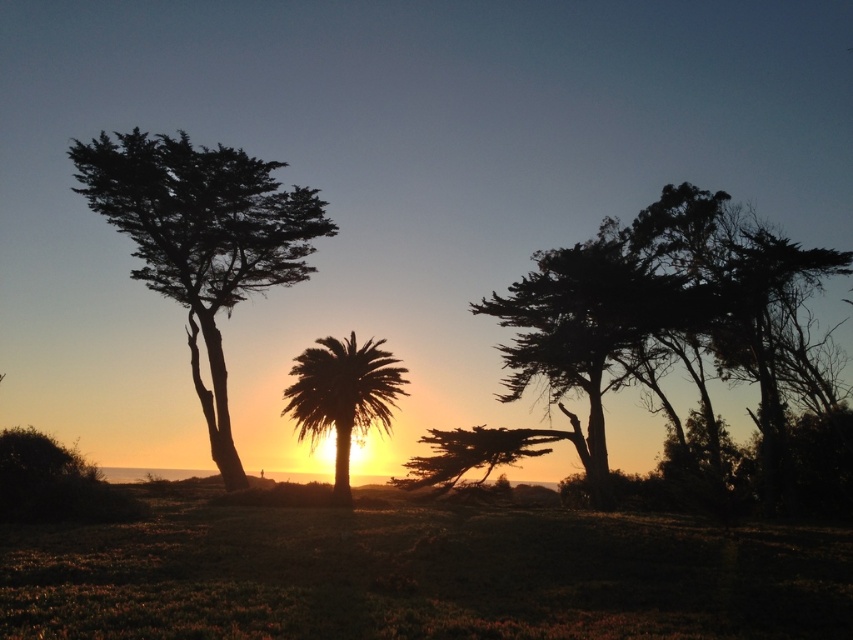
Is green grassy at lower center taller than silhouette palm tree at center?

No.

Describe the element at coordinates (421, 576) in the screenshot. The width and height of the screenshot is (853, 640). I see `green grassy at lower center` at that location.

The height and width of the screenshot is (640, 853). In order to click on green grassy at lower center in this screenshot , I will do `click(421, 576)`.

Is point (599, 323) less distant than point (323, 225)?

Yes, point (599, 323) is in front of point (323, 225).

Is silhouette wood tree at right above silhouette/leafy tree at left?

Incorrect, silhouette wood tree at right is not positioned above silhouette/leafy tree at left.

Describe the element at coordinates (639, 332) in the screenshot. The image size is (853, 640). I see `silhouette wood tree at right` at that location.

Find the location of `silhouette wood tree at right`. silhouette wood tree at right is located at coordinates (639, 332).

Between point (306, 566) and point (798, 253), which one is positioned behind?

Positioned behind is point (798, 253).

The height and width of the screenshot is (640, 853). Describe the element at coordinates (421, 576) in the screenshot. I see `green grassy at lower center` at that location.

Who is more distant from viewer, (x=45, y=614) or (x=758, y=422)?

Positioned behind is point (x=758, y=422).

The image size is (853, 640). I want to click on green grassy at lower center, so click(x=421, y=576).